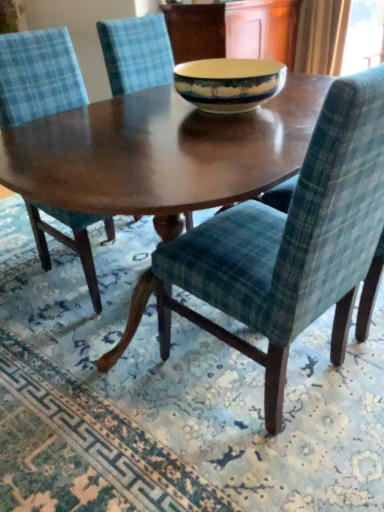
Question: Is velvet blue chair at center, which ranks as the first chair in left-to-right order, to the right of matte ceramic bowl at center from the viewer's perspective?

Choices:
 (A) no
 (B) yes

Answer: (A)

Question: Can you see velvet blue chair at center, which ranks as the 3th chair in right-to-left order, touching matte ceramic bowl at center?

Choices:
 (A) no
 (B) yes

Answer: (A)

Question: Is velvet blue chair at center, which ranks as the 3th chair in right-to-left order, aimed at matte ceramic bowl at center?

Choices:
 (A) yes
 (B) no

Answer: (B)

Question: Is velvet blue chair at center, which ranks as the 3th chair in right-to-left order, positioned far away from matte ceramic bowl at center?

Choices:
 (A) yes
 (B) no

Answer: (B)

Question: Can you confirm if velvet blue chair at center, which ranks as the 3th chair in right-to-left order, is bigger than matte ceramic bowl at center?

Choices:
 (A) no
 (B) yes

Answer: (B)

Question: From a real-world perspective, relative to green plaid fabric at lower right, is velvet blue chair at center, which ranks as the 2th chair in left-to-right order, vertically above or below?

Choices:
 (A) above
 (B) below

Answer: (A)

Question: Visually, is velvet blue chair at center, which ranks as the 2th chair in left-to-right order, positioned to the left or to the right of green plaid fabric at lower right?

Choices:
 (A) left
 (B) right

Answer: (B)

Question: In the image, is velvet blue chair at center, which ranks as the 2th chair in left-to-right order, positioned in front of or behind green plaid fabric at lower right?

Choices:
 (A) behind
 (B) front

Answer: (A)

Question: From their relative heights in the image, would you say velvet blue chair at center, which ranks as the 2th chair in right-to-left order, is taller or shorter than green plaid fabric at lower right?

Choices:
 (A) tall
 (B) short

Answer: (A)

Question: In terms of size, does green plaid fabric at lower right appear bigger or smaller than matte ceramic bowl at center?

Choices:
 (A) small
 (B) big

Answer: (B)

Question: Considering their positions, is green plaid fabric at lower right located in front of or behind matte ceramic bowl at center?

Choices:
 (A) front
 (B) behind

Answer: (A)

Question: From the image's perspective, relative to matte ceramic bowl at center, is green plaid fabric at lower right above or below?

Choices:
 (A) above
 (B) below

Answer: (B)

Question: Would you say green plaid fabric at lower right is to the left or to the right of matte ceramic bowl at center in the picture?

Choices:
 (A) right
 (B) left

Answer: (B)

Question: Considering the positions of velvet green chair at center, which appears as the 1th chair when viewed from the right, and green plaid fabric at lower right in the image, is velvet green chair at center, which appears as the 1th chair when viewed from the right, wider or thinner than green plaid fabric at lower right?

Choices:
 (A) thin
 (B) wide

Answer: (A)

Question: From the image's perspective, relative to green plaid fabric at lower right, is velvet green chair at center, which is the third chair from left to right, above or below?

Choices:
 (A) above
 (B) below

Answer: (A)